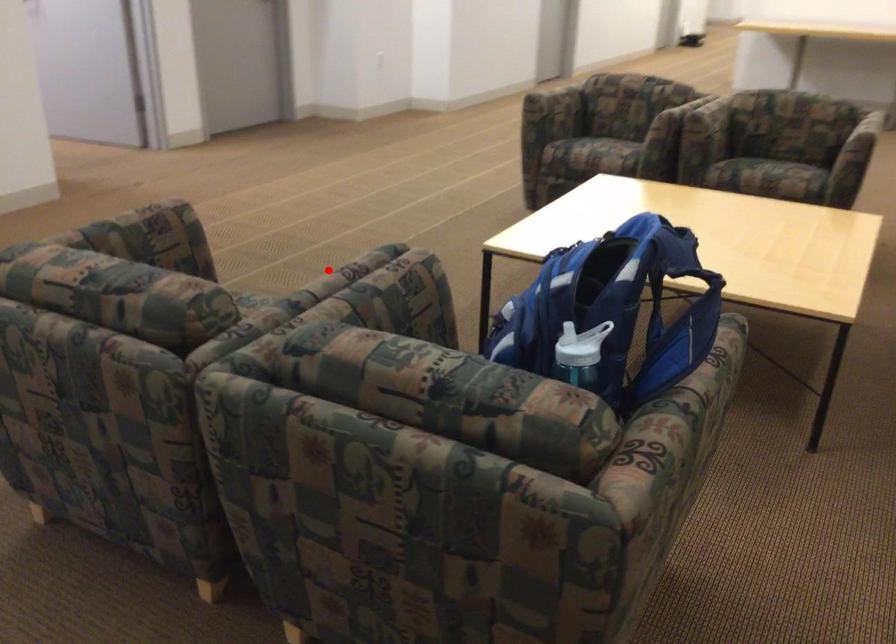
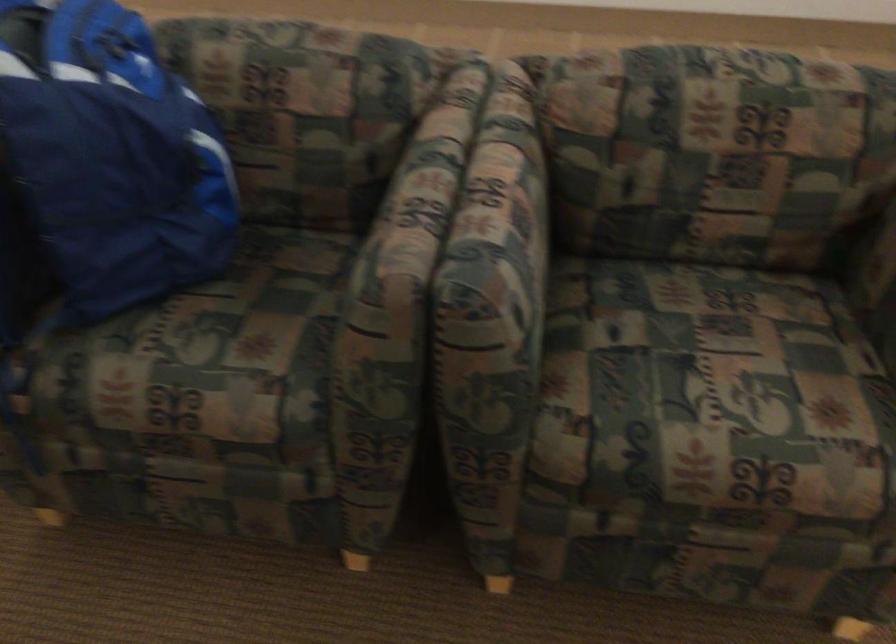
The point at the highlighted location is marked in the first image. Where is the corresponding point in the second image?

(510, 196)